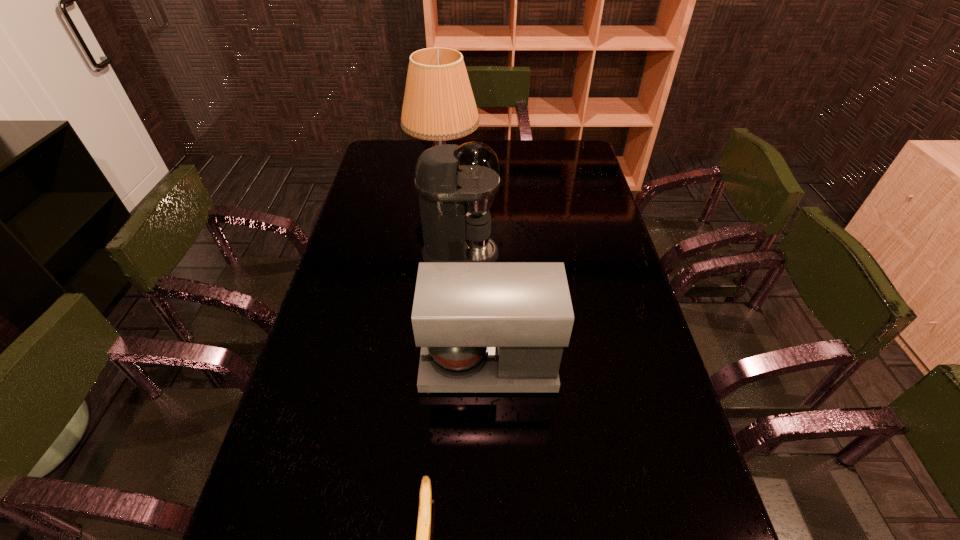
Where is `blank space located 0.090m on the carafe side of the nearer coffee maker`? The image size is (960, 540). blank space located 0.090m on the carafe side of the nearer coffee maker is located at coordinates (387, 363).

At what (x,y) coordinates should I click in order to perform the action: click on object present at the far edge. Please return your answer as a coordinate pair (x, y). The height and width of the screenshot is (540, 960). Looking at the image, I should click on (438, 105).

This screenshot has height=540, width=960. In the image, there is a desktop. Identify the location of vacant space at the far edge. (500, 140).

In the image, there is a desktop. Find the location of `vacant space at the left edge`. vacant space at the left edge is located at coordinates (372, 171).

Where is `vacant space at the right edge of the desktop`? vacant space at the right edge of the desktop is located at coordinates (609, 258).

Identify the location of free space at the far left corner of the desktop. The height and width of the screenshot is (540, 960). (386, 167).

Where is `vacant space at the far right corner of the desktop`? vacant space at the far right corner of the desktop is located at coordinates (562, 161).

At what (x,y) coordinates should I click in order to perform the action: click on object that is the second closest to the farther coffee maker. Please return your answer as a coordinate pair (x, y). This screenshot has width=960, height=540. Looking at the image, I should click on click(483, 327).

Select which object is the third closest to the nearer coffee maker. Please provide its 2D coordinates. Your answer should be formatted as a tuple, i.e. [(x, y)], where the tuple contains the x and y coordinates of a point satisfying the conditions above.

[(438, 105)]